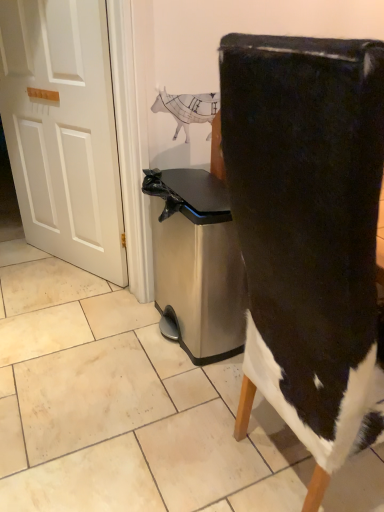
Question: From the image's perspective, relative to black suede chair at center, is white matte door at left above or below?

Choices:
 (A) below
 (B) above

Answer: (B)

Question: Is white matte door at left situated inside black suede chair at center or outside?

Choices:
 (A) inside
 (B) outside

Answer: (B)

Question: Estimate the real-world distances between objects in this image. Which object is closer to the stainless steel trash can at center?

Choices:
 (A) black suede chair at center
 (B) white matte door at left

Answer: (B)

Question: Estimate the real-world distances between objects in this image. Which object is farther from the white matte door at left?

Choices:
 (A) stainless steel trash can at center
 (B) black suede chair at center

Answer: (B)